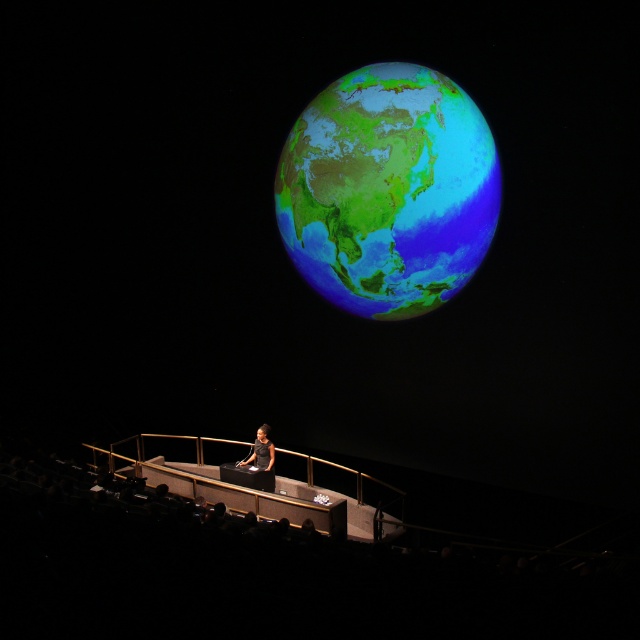
You are an event planner arranging a presentation. You want to ensure that the shiny metallic globe at upper center and the black matte dress at center are both visible to the audience. Considering their positions and sizes, which object might block the view of the other?

The shiny metallic globe at upper center might be wider than the black matte dress at center, so it could potentially block the view of the black matte dress at center if positioned in front of it.